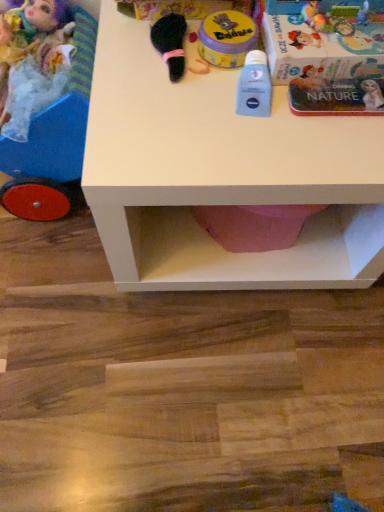
Question: Does yellow matte container at upper center, positioned as the third toy in left-to-right order, have a greater height compared to metallic silver book at upper right?

Choices:
 (A) yes
 (B) no

Answer: (B)

Question: Is yellow matte container at upper center, acting as the 2th toy starting from the right, looking in the opposite direction of metallic silver book at upper right?

Choices:
 (A) no
 (B) yes

Answer: (A)

Question: Is yellow matte container at upper center, positioned as the third toy in left-to-right order, not inside metallic silver book at upper right?

Choices:
 (A) no
 (B) yes

Answer: (B)

Question: Does yellow matte container at upper center, positioned as the third toy in left-to-right order, have a lesser width compared to metallic silver book at upper right?

Choices:
 (A) no
 (B) yes

Answer: (B)

Question: Does yellow matte container at upper center, positioned as the third toy in left-to-right order, turn towards metallic silver book at upper right?

Choices:
 (A) yes
 (B) no

Answer: (B)

Question: Looking at their shapes, would you say plush doll at left, which is the 1th toy in left-to-right order, is wider or thinner than blue matte lotion at center, the 1th toy viewed from the right?

Choices:
 (A) thin
 (B) wide

Answer: (B)

Question: From the image's perspective, is plush doll at left, which is the 1th toy in left-to-right order, positioned above or below blue matte lotion at center, the 1th toy viewed from the right?

Choices:
 (A) above
 (B) below

Answer: (A)

Question: Considering the positions of plush doll at left, arranged as the fourth toy when viewed from the right, and blue matte lotion at center, which appears as the fourth toy when viewed from the left, in the image, is plush doll at left, arranged as the fourth toy when viewed from the right, taller or shorter than blue matte lotion at center, which appears as the fourth toy when viewed from the left,?

Choices:
 (A) tall
 (B) short

Answer: (A)

Question: In the image, is plush doll at left, arranged as the fourth toy when viewed from the right, positioned in front of or behind blue matte lotion at center, which appears as the fourth toy when viewed from the left?

Choices:
 (A) behind
 (B) front

Answer: (A)

Question: Is white matte table at center bigger or smaller than yellow matte container at upper center, acting as the 2th toy starting from the right?

Choices:
 (A) small
 (B) big

Answer: (B)

Question: In the image, is white matte table at center positioned in front of or behind yellow matte container at upper center, acting as the 2th toy starting from the right?

Choices:
 (A) front
 (B) behind

Answer: (A)

Question: Is white matte table at center taller or shorter than yellow matte container at upper center, acting as the 2th toy starting from the right?

Choices:
 (A) tall
 (B) short

Answer: (A)

Question: Does point (104, 38) appear closer or farther from the camera than point (198, 36)?

Choices:
 (A) closer
 (B) farther

Answer: (B)

Question: From the image's perspective, relative to white matte table at center, is matte plastic doll carriage at left, which is the 2th toy in left-to-right order, above or below?

Choices:
 (A) above
 (B) below

Answer: (A)

Question: Based on their sizes in the image, would you say matte plastic doll carriage at left, placed as the 3th toy when sorted from right to left, is bigger or smaller than white matte table at center?

Choices:
 (A) big
 (B) small

Answer: (B)